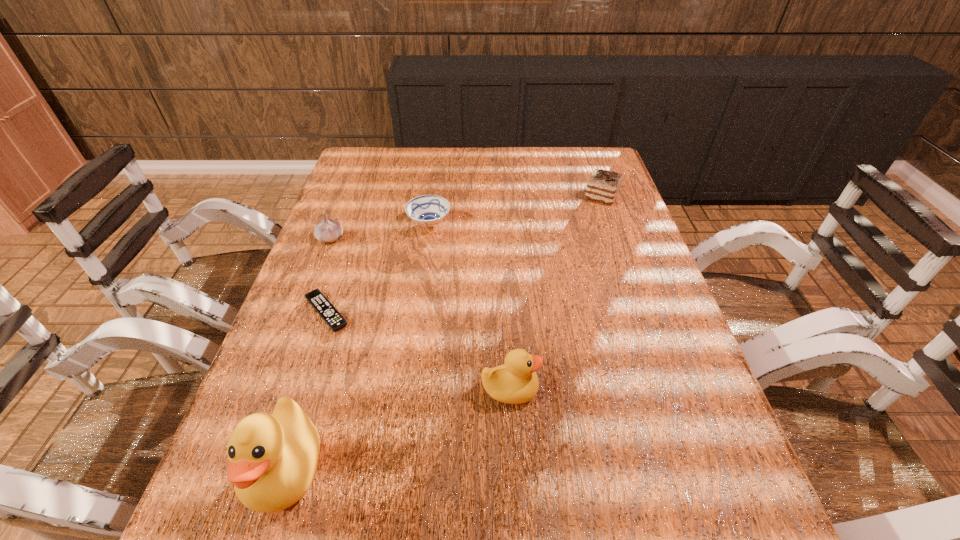
Image resolution: width=960 pixels, height=540 pixels. I want to click on vacant area in the image that satisfies the following two spatial constraints: 1. on the back side of the fourth object from left to right; 2. on the left side of the garlic, so click(x=336, y=224).

Find the location of a particular element. This screenshot has width=960, height=540. free spot that satisfies the following two spatial constraints: 1. on the front side of the farthest object; 2. at the beak of the second tallest object is located at coordinates (670, 390).